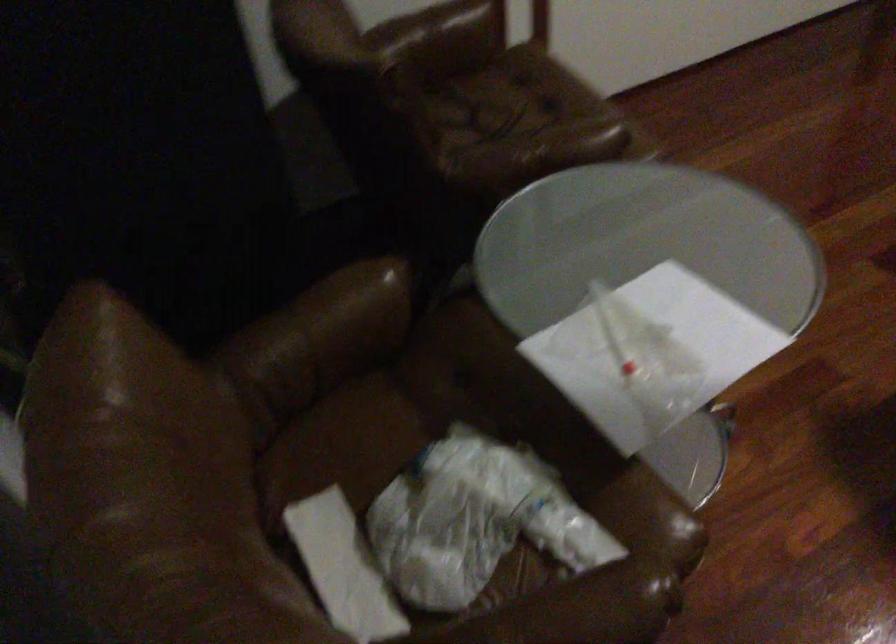
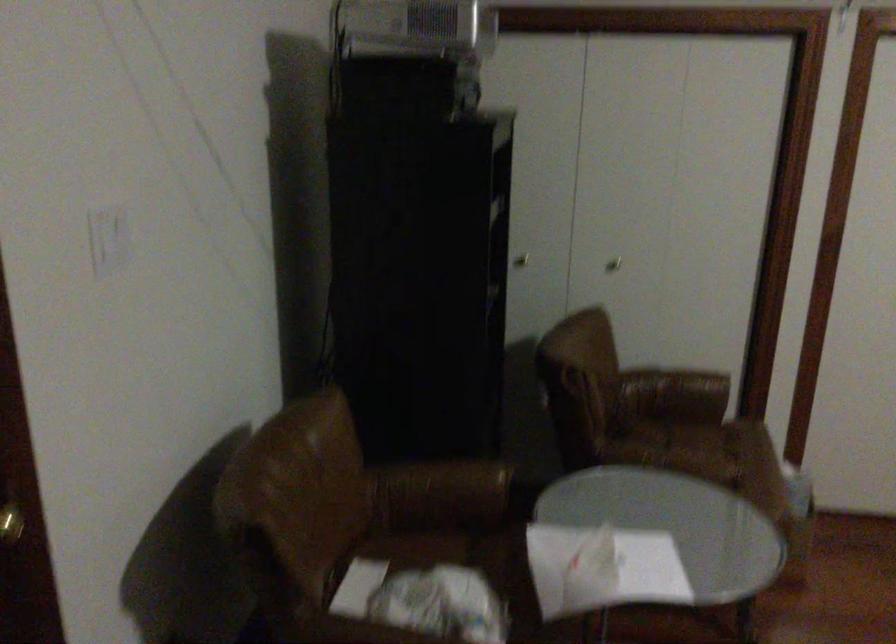
Find the pixel in the second image that matches (510,89) in the first image.

(718, 442)